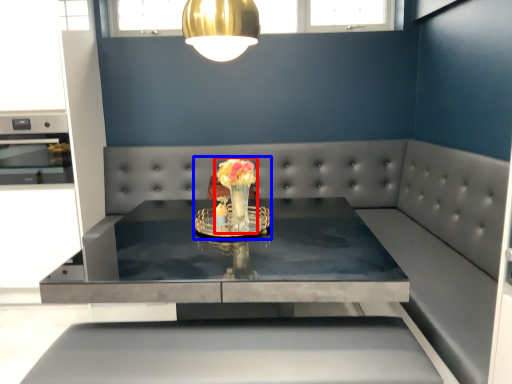
Question: Among these objects, which one is farthest to the camera, floral arrangement (highlighted by a red box) or floral arrangement (highlighted by a blue box)?

Choices:
 (A) floral arrangement
 (B) floral arrangement

Answer: (B)